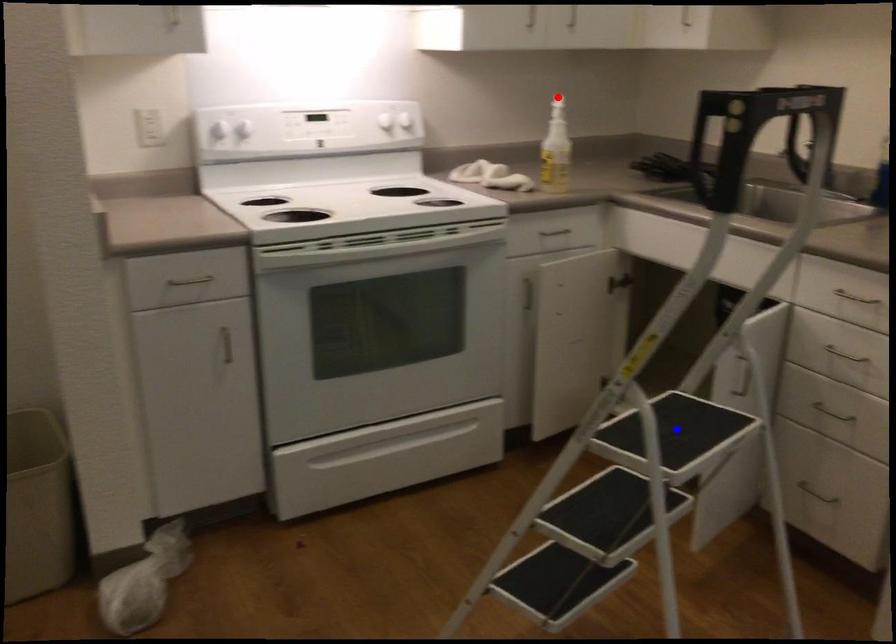
Question: Which of the two points in the image is closer to the camera?

Choices:
 (A) Blue point is closer.
 (B) Red point is closer.

Answer: (A)